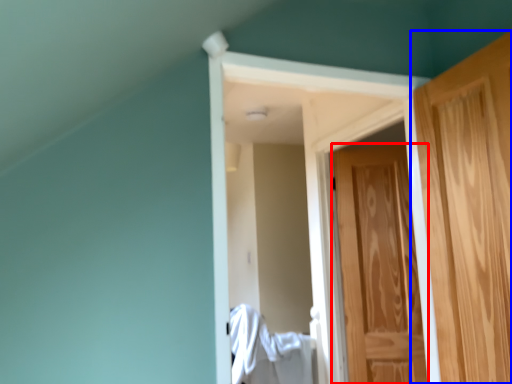
Question: Which object is closer to the camera taking this photo, door (highlighted by a red box) or door (highlighted by a blue box)?

Choices:
 (A) door
 (B) door

Answer: (B)